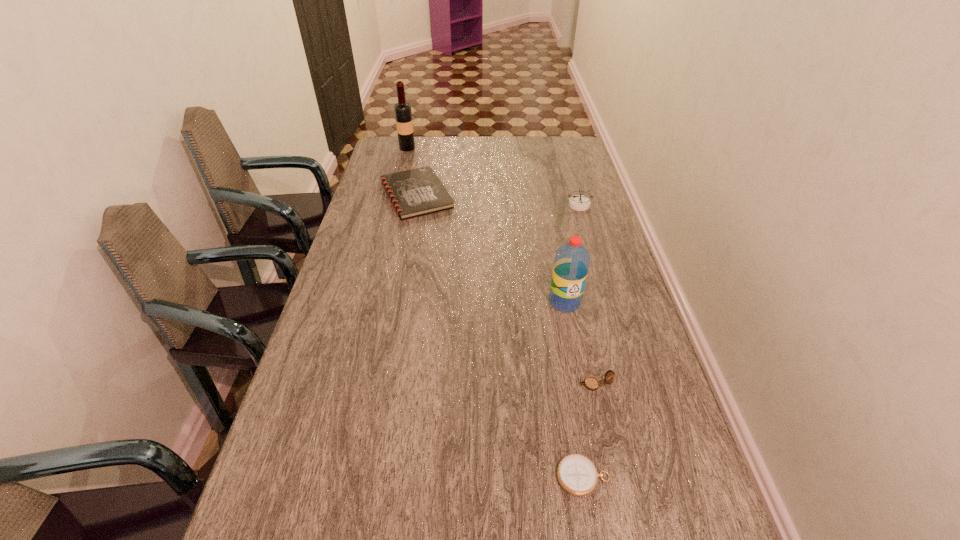
Locate an element on the screen. This screenshot has width=960, height=540. vacant area that lies between the farthest object and the water bottle is located at coordinates (486, 225).

In order to click on unoccupied position between the water bottle and the tallest object in this screenshot , I will do `click(486, 225)`.

I want to click on empty space that is in between the second farthest compass and the notebook, so click(505, 289).

Locate an element on the screen. This screenshot has height=540, width=960. free space that is in between the shortest object and the notebook is located at coordinates (500, 336).

You are a GUI agent. You are given a task and a screenshot of the screen. Output one action in this format:
    pyautogui.click(x=<x>, y=<y>)
    Task: Click on the vacant area between the rightmost compass and the wine bottle
    This screenshot has width=960, height=540.
    Given the screenshot: What is the action you would take?
    pyautogui.click(x=493, y=176)

This screenshot has width=960, height=540. In order to click on free space between the farthest object and the second tallest compass in this screenshot , I will do `click(501, 266)`.

You are a GUI agent. You are given a task and a screenshot of the screen. Output one action in this format:
    pyautogui.click(x=<x>, y=<y>)
    Task: Click on the vacant point located between the notebook and the third shortest object
    The width and height of the screenshot is (960, 540).
    Given the screenshot: What is the action you would take?
    pyautogui.click(x=505, y=289)

Identify the location of object that is the fourth closest to the nearest object. (577, 202).

Identify which object is the fifth nearest to the rightmost compass. Please provide its 2D coordinates. Your answer should be formatted as a tuple, i.e. [(x, y)], where the tuple contains the x and y coordinates of a point satisfying the conditions above.

[(577, 475)]

At what (x,y) coordinates should I click in order to perform the action: click on compass that is the nearest to the fifth tallest object. Please return your answer as a coordinate pair (x, y). The image size is (960, 540). Looking at the image, I should click on (577, 202).